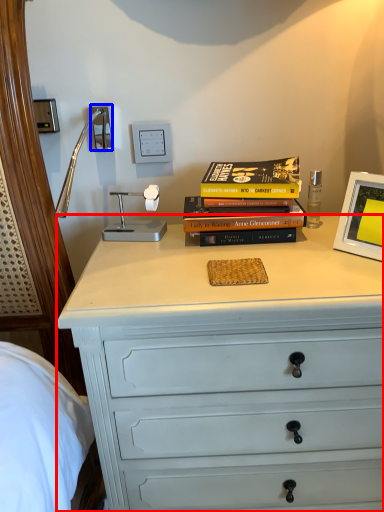
Question: Which of the following is the farthest to the observer, chest of drawers (highlighted by a red box) or electric outlet (highlighted by a blue box)?

Choices:
 (A) chest of drawers
 (B) electric outlet

Answer: (B)